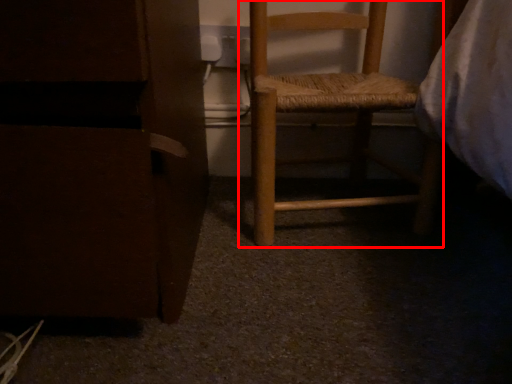
Question: From the image's perspective, what is the correct spatial positioning of furniture (annotated by the red box) in reference to furniture?

Choices:
 (A) below
 (B) above

Answer: (B)